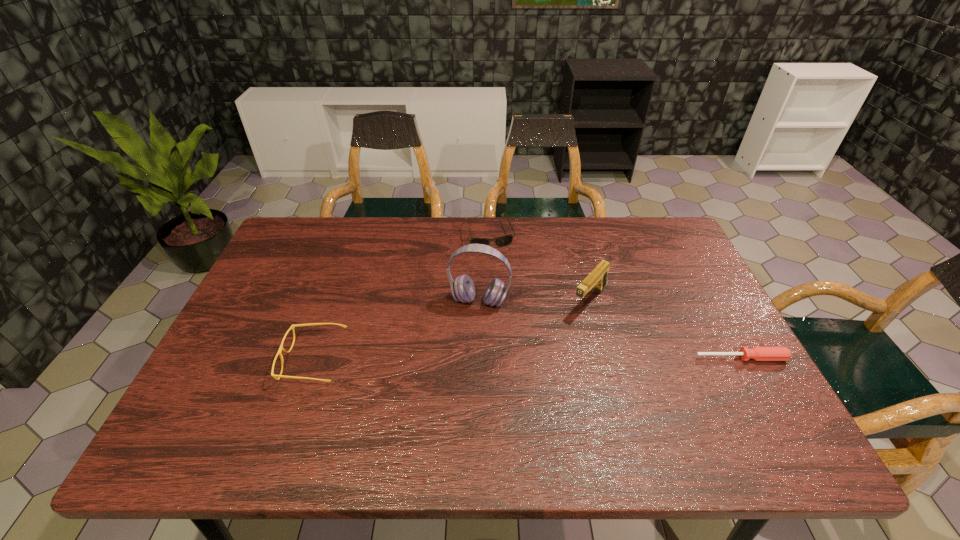
Identify the location of free spot on the desktop that is between the spectacles and the screwdriver and is positioned at the barrel of the pistol. (539, 359).

At what (x,y) coordinates should I click in order to perform the action: click on free spot on the desktop that is between the spectacles and the shortest object and is positioned on the lenses of the sunglasses. Please return your answer as a coordinate pair (x, y). Looking at the image, I should click on (526, 359).

The height and width of the screenshot is (540, 960). I want to click on free space on the desktop that is between the spectacles and the rightmost object and is positioned on the headband and ear cups of the headset, so pos(465,360).